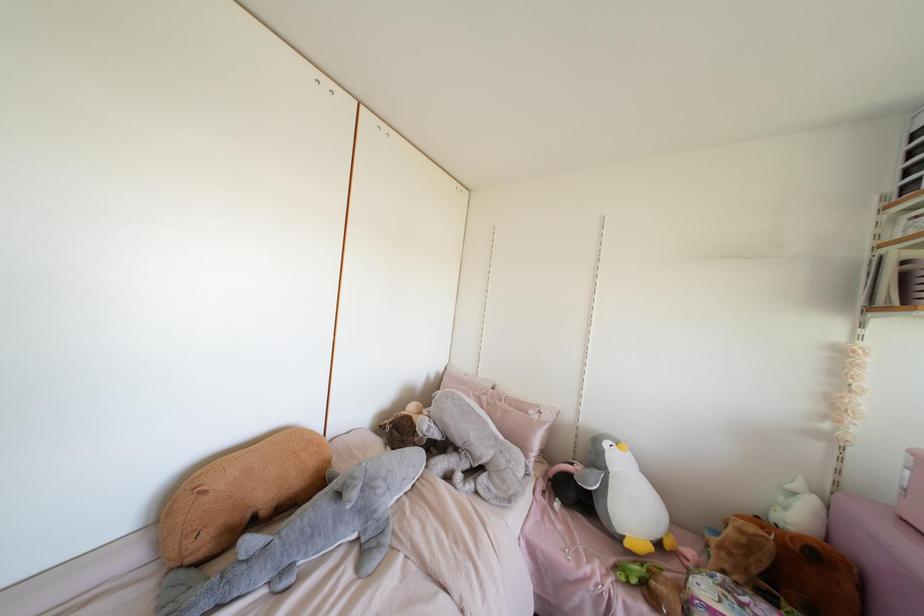
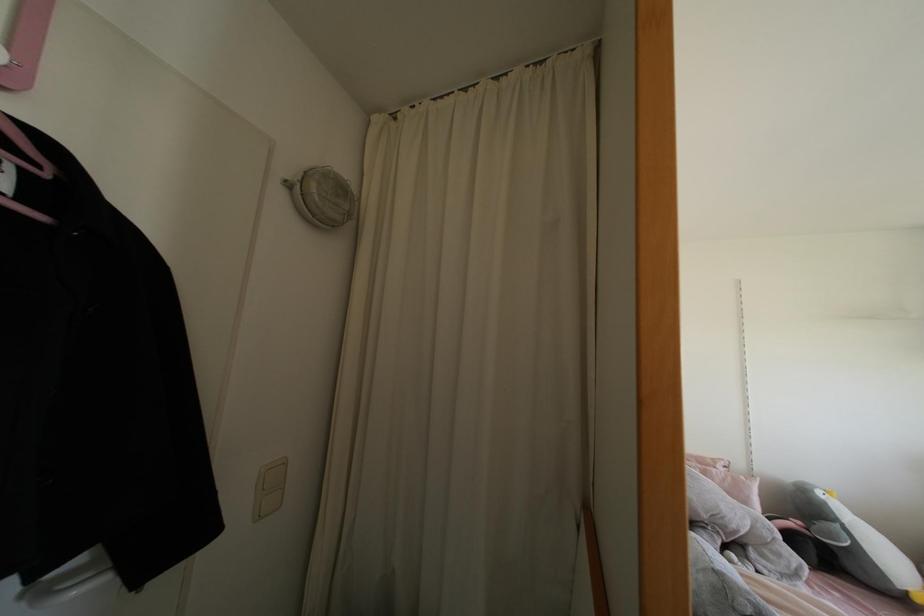
The point at (604, 444) is marked in the first image. Where is the corresponding point in the second image?

(819, 493)